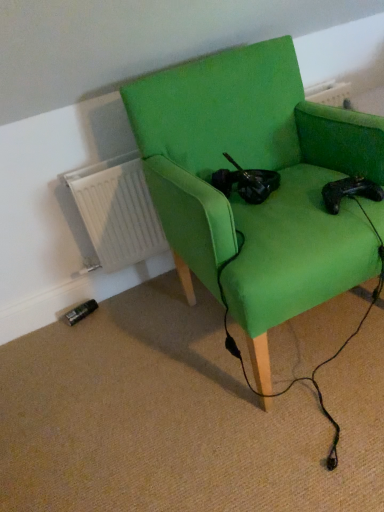
From the picture: What is the approximate width of green fabric chair at center?

green fabric chair at center is 29.45 inches wide.

I want to click on green fabric chair at center, so click(x=256, y=167).

What do you see at coordinates (256, 167) in the screenshot?
I see `green fabric chair at center` at bounding box center [256, 167].

I want to click on green fabric chair at center, so (256, 167).